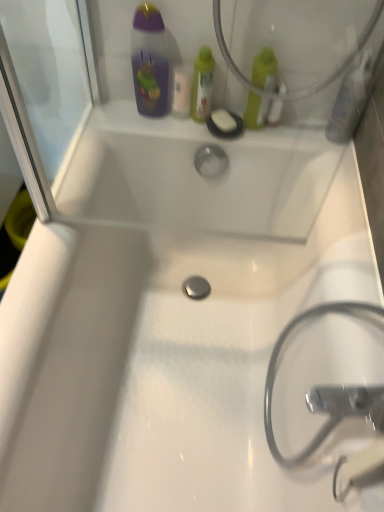
What do you see at coordinates (275, 372) in the screenshot? I see `metallic silver hose at lower right` at bounding box center [275, 372].

The height and width of the screenshot is (512, 384). In order to click on green plastic bottle at upper center, which ranks as the second mouthwash in left-to-right order in this screenshot , I will do `click(202, 85)`.

This screenshot has width=384, height=512. What do you see at coordinates (275, 111) in the screenshot? I see `translucent plastic mouthwash at upper right, which is the fourth mouthwash from left to right` at bounding box center [275, 111].

What is the approximate width of translucent plastic mouthwash at upper center, which appears as the fifth mouthwash when viewed from the right?

translucent plastic mouthwash at upper center, which appears as the fifth mouthwash when viewed from the right, is 1.62 inches wide.

Measure the distance between point (175, 80) and camera.

A distance of 3.43 feet exists between point (175, 80) and camera.

Where is `green matte bottle at upper right, arranged as the 3th mouthwash when viewed from the right`? green matte bottle at upper right, arranged as the 3th mouthwash when viewed from the right is located at coordinates (265, 70).

The image size is (384, 512). Find the location of `translucent plastic mouthwash at upper right, the 5th mouthwash positioned from the left`. translucent plastic mouthwash at upper right, the 5th mouthwash positioned from the left is located at coordinates (351, 99).

Find the location of a particular element. The width and height of the screenshot is (384, 512). metallic silver hose at lower right is located at coordinates (275, 372).

Considering the sizes of translucent plastic mouthwash at upper right, which is the fourth mouthwash from left to right, and metallic silver hose at lower right in the image, is translucent plastic mouthwash at upper right, which is the fourth mouthwash from left to right, taller or shorter than metallic silver hose at lower right?

Considering their sizes, translucent plastic mouthwash at upper right, which is the fourth mouthwash from left to right, has less height than metallic silver hose at lower right.

Is translucent plastic mouthwash at upper right, which is the fourth mouthwash from left to right, facing towards metallic silver hose at lower right?

Yes, translucent plastic mouthwash at upper right, which is the fourth mouthwash from left to right, is oriented towards metallic silver hose at lower right.

Is the depth of translucent plastic mouthwash at upper right, which is the fourth mouthwash from left to right, greater than that of metallic silver hose at lower right?

Yes, translucent plastic mouthwash at upper right, which is the fourth mouthwash from left to right, is further from the camera.

Considering the relative sizes of translucent plastic mouthwash at upper center, which appears as the fifth mouthwash when viewed from the right, and white matte soap at upper center in the image provided, is translucent plastic mouthwash at upper center, which appears as the fifth mouthwash when viewed from the right, shorter than white matte soap at upper center?

No.

Is translucent plastic mouthwash at upper center, which appears as the fifth mouthwash when viewed from the right, oriented away from white matte soap at upper center?

That's not correct — translucent plastic mouthwash at upper center, which appears as the fifth mouthwash when viewed from the right, is not looking away from white matte soap at upper center.

From a real-world perspective, which object rests below the other?

In real-world perspective, white matte soap at upper center is lower.

From the white matte soap at upper center, count 3rd mouthwash to the right and point to it. Please provide its 2D coordinates.

[(351, 99)]

Does white matte soap at upper center come behind translucent plastic mouthwash at upper right, arranged as the first mouthwash when viewed from the right?

Yes.

Is white matte soap at upper center next to translucent plastic mouthwash at upper right, arranged as the first mouthwash when viewed from the right, and touching it?

white matte soap at upper center and translucent plastic mouthwash at upper right, arranged as the first mouthwash when viewed from the right, are not in contact.

From a real-world perspective, is white matte soap at upper center physically above translucent plastic mouthwash at upper right, arranged as the first mouthwash when viewed from the right?

No, from a real-world perspective, white matte soap at upper center is not above translucent plastic mouthwash at upper right, arranged as the first mouthwash when viewed from the right.

Consider the image. Is translucent plastic mouthwash at upper right, which appears as the 2th mouthwash when viewed from the right, beside green matte bottle at upper right, placed as the 3th mouthwash when sorted from left to right?

Yes, translucent plastic mouthwash at upper right, which appears as the 2th mouthwash when viewed from the right, is beside green matte bottle at upper right, placed as the 3th mouthwash when sorted from left to right.

Considering the relative sizes of translucent plastic mouthwash at upper right, which is the fourth mouthwash from left to right, and green matte bottle at upper right, placed as the 3th mouthwash when sorted from left to right, in the image provided, is translucent plastic mouthwash at upper right, which is the fourth mouthwash from left to right, shorter than green matte bottle at upper right, placed as the 3th mouthwash when sorted from left to right,?

Indeed, translucent plastic mouthwash at upper right, which is the fourth mouthwash from left to right, has a lesser height compared to green matte bottle at upper right, placed as the 3th mouthwash when sorted from left to right.

Is translucent plastic mouthwash at upper right, which is the fourth mouthwash from left to right, wider or thinner than green matte bottle at upper right, arranged as the 3th mouthwash when viewed from the right?

Considering their sizes, translucent plastic mouthwash at upper right, which is the fourth mouthwash from left to right, looks slimmer than green matte bottle at upper right, arranged as the 3th mouthwash when viewed from the right.

Can you confirm if translucent plastic mouthwash at upper center, which appears as the fifth mouthwash when viewed from the right, is shorter than green plastic bottle at upper center, which ranks as the second mouthwash in left-to-right order?

Indeed, translucent plastic mouthwash at upper center, which appears as the fifth mouthwash when viewed from the right, has a lesser height compared to green plastic bottle at upper center, which ranks as the second mouthwash in left-to-right order.

Is translucent plastic mouthwash at upper center, which appears as the fifth mouthwash when viewed from the right, oriented away from green plastic bottle at upper center, the fourth mouthwash positioned from the right?

No, translucent plastic mouthwash at upper center, which appears as the fifth mouthwash when viewed from the right,'s orientation is not away from green plastic bottle at upper center, the fourth mouthwash positioned from the right.

From a real-world perspective, is translucent plastic mouthwash at upper center, which appears as the fifth mouthwash when viewed from the right, over green plastic bottle at upper center, the fourth mouthwash positioned from the right?

Incorrect, from a real-world perspective, translucent plastic mouthwash at upper center, which appears as the fifth mouthwash when viewed from the right, is lower than green plastic bottle at upper center, the fourth mouthwash positioned from the right.

Locate an element on the screen. This screenshot has width=384, height=512. mouthwash that is the 2nd one when counting backward from the green plastic bottle at upper center, the fourth mouthwash positioned from the right is located at coordinates (182, 89).

Locate an element on the screen. This screenshot has width=384, height=512. the 3rd mouthwash to the right of the green plastic bottle at upper center, the fourth mouthwash positioned from the right, starting your count from the anchor is located at coordinates (351, 99).

How many degrees apart are the facing directions of green plastic bottle at upper center, which ranks as the second mouthwash in left-to-right order, and translucent plastic mouthwash at upper right, the 5th mouthwash positioned from the left?

The angle between the facing direction of green plastic bottle at upper center, which ranks as the second mouthwash in left-to-right order, and the facing direction of translucent plastic mouthwash at upper right, the 5th mouthwash positioned from the left, is 1.97 degrees.

Looking at their sizes, would you say green plastic bottle at upper center, the fourth mouthwash positioned from the right, is wider or thinner than translucent plastic mouthwash at upper right, arranged as the first mouthwash when viewed from the right?

Considering their sizes, green plastic bottle at upper center, the fourth mouthwash positioned from the right, looks slimmer than translucent plastic mouthwash at upper right, arranged as the first mouthwash when viewed from the right.

From the image's perspective, between green plastic bottle at upper center, which ranks as the second mouthwash in left-to-right order, and translucent plastic mouthwash at upper right, the 5th mouthwash positioned from the left, who is located below?

From the image's view, translucent plastic mouthwash at upper right, the 5th mouthwash positioned from the left, is below.

From a real-world perspective, relative to green plastic bottle at upper center, the fourth mouthwash positioned from the right, is green matte bottle at upper right, placed as the 3th mouthwash when sorted from left to right, vertically above or below?

green matte bottle at upper right, placed as the 3th mouthwash when sorted from left to right, is above green plastic bottle at upper center, the fourth mouthwash positioned from the right.

Considering the sizes of objects green matte bottle at upper right, arranged as the 3th mouthwash when viewed from the right, and green plastic bottle at upper center, the fourth mouthwash positioned from the right, in the image provided, who is thinner, green matte bottle at upper right, arranged as the 3th mouthwash when viewed from the right, or green plastic bottle at upper center, the fourth mouthwash positioned from the right,?

green matte bottle at upper right, arranged as the 3th mouthwash when viewed from the right, is thinner.

Is green matte bottle at upper right, arranged as the 3th mouthwash when viewed from the right, positioned beyond the bounds of green plastic bottle at upper center, which ranks as the second mouthwash in left-to-right order?

Yes, green matte bottle at upper right, arranged as the 3th mouthwash when viewed from the right, is outside of green plastic bottle at upper center, which ranks as the second mouthwash in left-to-right order.

Locate an element on the screen. The height and width of the screenshot is (512, 384). garden hose located in front of the translucent plastic mouthwash at upper right, which is the fourth mouthwash from left to right is located at coordinates (275, 372).

At what (x,y) coordinates should I click in order to perform the action: click on soap below the translucent plastic mouthwash at upper center, which appears as the fifth mouthwash when viewed from the right (from a real-world perspective). Please return your answer as a coordinate pair (x, y). Looking at the image, I should click on (224, 121).

From the image, which object appears to be farther from translucent plastic mouthwash at upper right, the 5th mouthwash positioned from the left, green plastic bottle at upper center, the fourth mouthwash positioned from the right, or translucent plastic mouthwash at upper right, which is the fourth mouthwash from left to right?

Based on the image, green plastic bottle at upper center, the fourth mouthwash positioned from the right, appears to be further to translucent plastic mouthwash at upper right, the 5th mouthwash positioned from the left.

Looking at the image, which one is located further to green matte bottle at upper right, arranged as the 3th mouthwash when viewed from the right, translucent plastic mouthwash at upper right, which appears as the 2th mouthwash when viewed from the right, or white matte soap at upper center?

Based on the image, white matte soap at upper center appears to be further to green matte bottle at upper right, arranged as the 3th mouthwash when viewed from the right.

Estimate the real-world distances between objects in this image. Which object is closer to translucent plastic mouthwash at upper right, the 5th mouthwash positioned from the left, metallic silver hose at lower right or translucent plastic mouthwash at upper right, which is the fourth mouthwash from left to right?

translucent plastic mouthwash at upper right, which is the fourth mouthwash from left to right, is positioned closer to the anchor translucent plastic mouthwash at upper right, the 5th mouthwash positioned from the left.

Considering their positions, is green matte bottle at upper right, placed as the 3th mouthwash when sorted from left to right, positioned further to translucent plastic mouthwash at upper right, which appears as the 2th mouthwash when viewed from the right, than translucent plastic mouthwash at upper center, which appears as the fifth mouthwash when viewed from the right?

translucent plastic mouthwash at upper center, which appears as the fifth mouthwash when viewed from the right.

Estimate the real-world distances between objects in this image. Which object is further from translucent plastic mouthwash at upper right, which is the fourth mouthwash from left to right, translucent plastic mouthwash at upper right, the 5th mouthwash positioned from the left, or metallic silver hose at lower right?

Among the two, metallic silver hose at lower right is located further to translucent plastic mouthwash at upper right, which is the fourth mouthwash from left to right.

Estimate the real-world distances between objects in this image. Which object is further from translucent plastic mouthwash at upper right, arranged as the first mouthwash when viewed from the right, green matte bottle at upper right, placed as the 3th mouthwash when sorted from left to right, or translucent plastic mouthwash at upper right, which is the fourth mouthwash from left to right?

green matte bottle at upper right, placed as the 3th mouthwash when sorted from left to right, lies further to translucent plastic mouthwash at upper right, arranged as the first mouthwash when viewed from the right, than the other object.

From the picture: From the image, which object appears to be nearer to translucent plastic mouthwash at upper right, which is the fourth mouthwash from left to right, green plastic bottle at upper center, the fourth mouthwash positioned from the right, or white matte soap at upper center?

white matte soap at upper center lies closer to translucent plastic mouthwash at upper right, which is the fourth mouthwash from left to right, than the other object.

Which object lies further to the anchor point green matte bottle at upper right, placed as the 3th mouthwash when sorted from left to right, metallic silver hose at lower right or white matte soap at upper center?

metallic silver hose at lower right lies further to green matte bottle at upper right, placed as the 3th mouthwash when sorted from left to right, than the other object.

This screenshot has width=384, height=512. What are the coordinates of `mouthwash between translucent plastic mouthwash at upper center, which appears as the fifth mouthwash when viewed from the right, and green matte bottle at upper right, placed as the 3th mouthwash when sorted from left to right, in the horizontal direction` in the screenshot? It's located at (202, 85).

What are the coordinates of `soap between translucent plastic mouthwash at upper center, which appears as the fifth mouthwash when viewed from the right, and green matte bottle at upper right, placed as the 3th mouthwash when sorted from left to right, from left to right` in the screenshot? It's located at (224, 121).

Where is `mouthwash between translucent plastic mouthwash at upper right, which appears as the 2th mouthwash when viewed from the right, and metallic silver hose at lower right from top to bottom`? This screenshot has width=384, height=512. mouthwash between translucent plastic mouthwash at upper right, which appears as the 2th mouthwash when viewed from the right, and metallic silver hose at lower right from top to bottom is located at coordinates (351, 99).

You are a GUI agent. You are given a task and a screenshot of the screen. Output one action in this format:
    pyautogui.click(x=<x>, y=<y>)
    Task: Click on the soap located between green plastic bottle at upper center, the fourth mouthwash positioned from the right, and translucent plastic mouthwash at upper right, the 5th mouthwash positioned from the left, in the left-right direction
    The width and height of the screenshot is (384, 512).
    Given the screenshot: What is the action you would take?
    pyautogui.click(x=224, y=121)